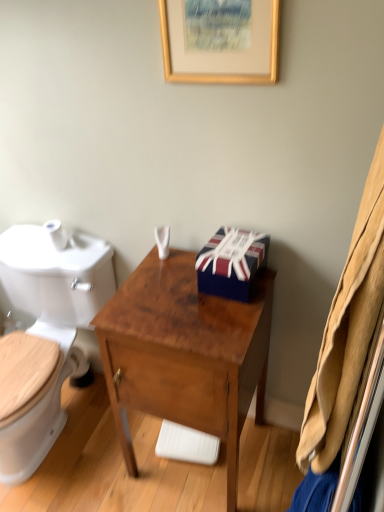
You are a GUI agent. You are given a task and a screenshot of the screen. Output one action in this format:
    pyautogui.click(x=<x>, y=<y>)
    Task: Click on the empty space that is ontop of brown wood desk at center (from a real-world perspective)
    Image resolution: width=384 pixels, height=512 pixels.
    Given the screenshot: What is the action you would take?
    pyautogui.click(x=184, y=304)